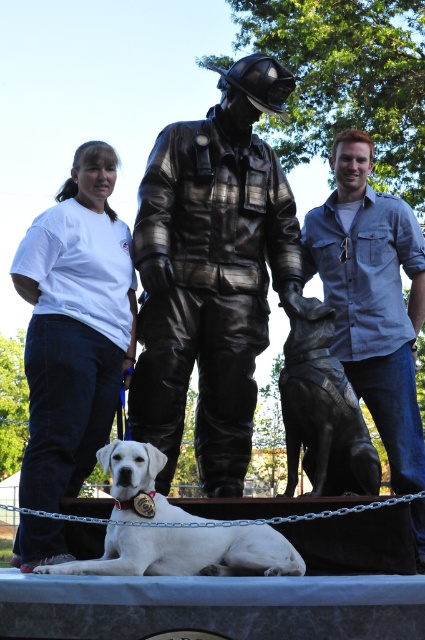
Does blue denim shirt at right come behind shiny black dog at center?

No, blue denim shirt at right is in front of shiny black dog at center.

Between point (374, 387) and point (343, 403), which one is positioned behind?

The point (374, 387) is behind.

At what (x,y) coordinates should I click in order to perform the action: click on blue denim shirt at right. Please return your answer as a coordinate pair (x, y). This screenshot has width=425, height=640. Looking at the image, I should click on 373,298.

Between white cotton shirt at left and shiny black dog at center, which one appears on the left side from the viewer's perspective?

From the viewer's perspective, white cotton shirt at left appears more on the left side.

Measure the distance between white cotton shirt at left and shiny black dog at center.

white cotton shirt at left and shiny black dog at center are 7.22 meters apart.

Find the location of a particular element. Image resolution: width=425 pixels, height=640 pixels. white cotton shirt at left is located at coordinates (73, 326).

Describe the element at coordinates (189, 552) in the screenshot. I see `white fur dog at lower center` at that location.

Does white fur dog at lower center have a greater height compared to shiny black dog at center?

No.

Describe the element at coordinates (189, 552) in the screenshot. Image resolution: width=425 pixels, height=640 pixels. I see `white fur dog at lower center` at that location.

At what (x,y) coordinates should I click in order to perform the action: click on white fur dog at lower center. Please return your answer as a coordinate pair (x, y). Image resolution: width=425 pixels, height=640 pixels. Looking at the image, I should click on (189, 552).